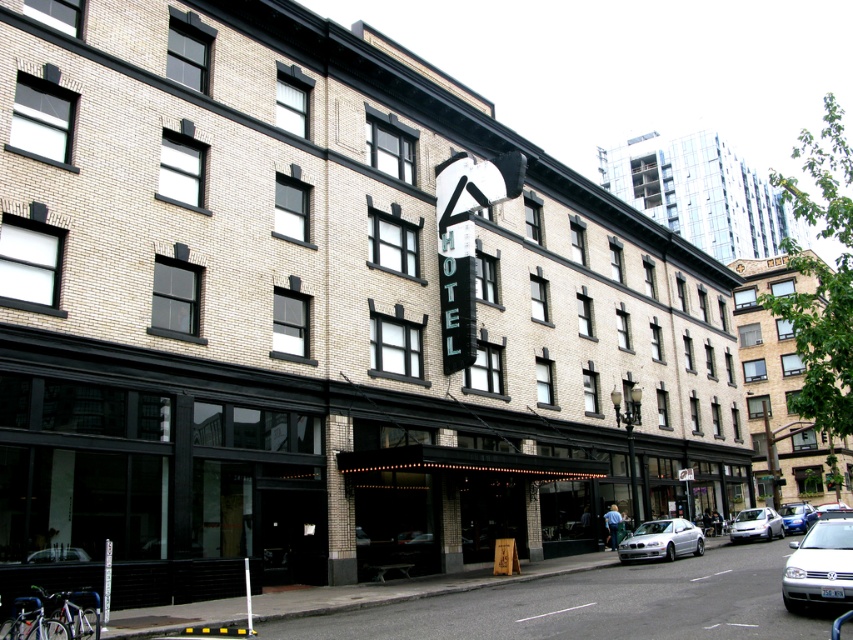
Question: Which object appears farthest from the camera in this image?

Choices:
 (A) white glossy sedan at lower right
 (B) metallic blue sedan at center-right
 (C) silver metallic sedan at center
 (D) metallic silver car at lower left

Answer: (B)

Question: Can you confirm if white matte sedan at lower right is smaller than metallic blue sedan at center-right?

Choices:
 (A) no
 (B) yes

Answer: (B)

Question: Which point is closer to the camera taking this photo?

Choices:
 (A) (815, 538)
 (B) (828, 504)
 (C) (691, 528)
 (D) (766, 513)

Answer: (A)

Question: Which point is farther to the camera?

Choices:
 (A) (670, 524)
 (B) (788, 504)
 (C) (840, 506)

Answer: (C)

Question: Does white matte sedan at lower right have a greater width compared to silver metallic sedan at center?

Choices:
 (A) yes
 (B) no

Answer: (A)

Question: Does white matte sedan at lower right have a lesser width compared to white glossy sedan at lower right?

Choices:
 (A) no
 (B) yes

Answer: (A)